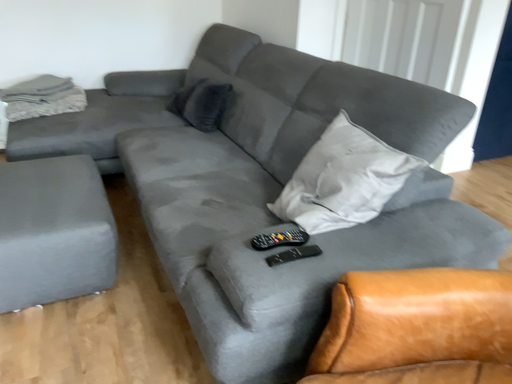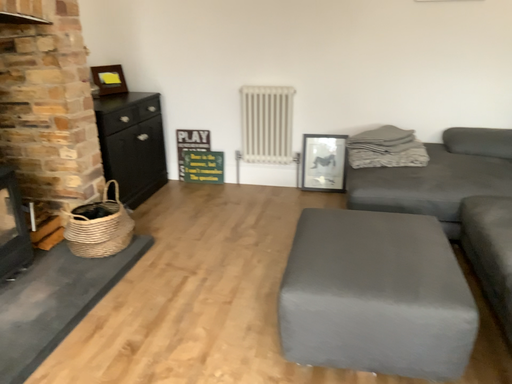
Question: How did the camera likely rotate when shooting the video?

Choices:
 (A) rotated downward
 (B) rotated upward

Answer: (B)